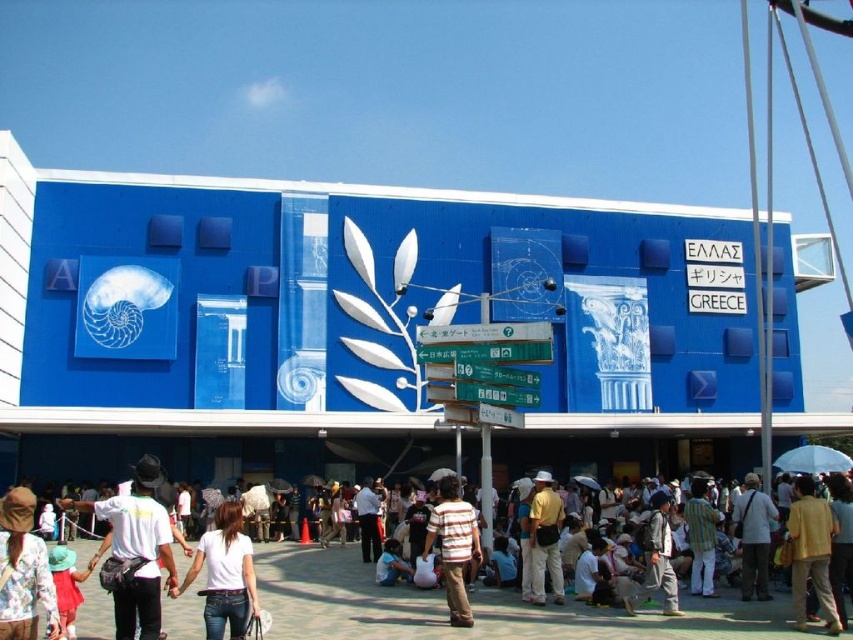
Question: Considering the relative positions of floral print shirt at lower left and brown fabric bag at center in the image provided, where is floral print shirt at lower left located with respect to brown fabric bag at center?

Choices:
 (A) right
 (B) left

Answer: (B)

Question: Can you confirm if yellow matte shirt at lower right is thinner than yellow cotton shirt at center?

Choices:
 (A) no
 (B) yes

Answer: (A)

Question: Can you confirm if blue painted wall at center is bigger than brown fabric bag at center?

Choices:
 (A) yes
 (B) no

Answer: (A)

Question: Which is farther from the yellow cotton shirt at center?

Choices:
 (A) brown striped shirt at center
 (B) white cotton shirt at lower center

Answer: (B)

Question: Which object appears farthest from the camera in this image?

Choices:
 (A) blue painted wall at center
 (B) floral print shirt at lower left
 (C) white matte shirt at center

Answer: (A)

Question: Which object is closer to the camera taking this photo?

Choices:
 (A) brown striped shirt at center
 (B) brown fabric bag at center

Answer: (A)